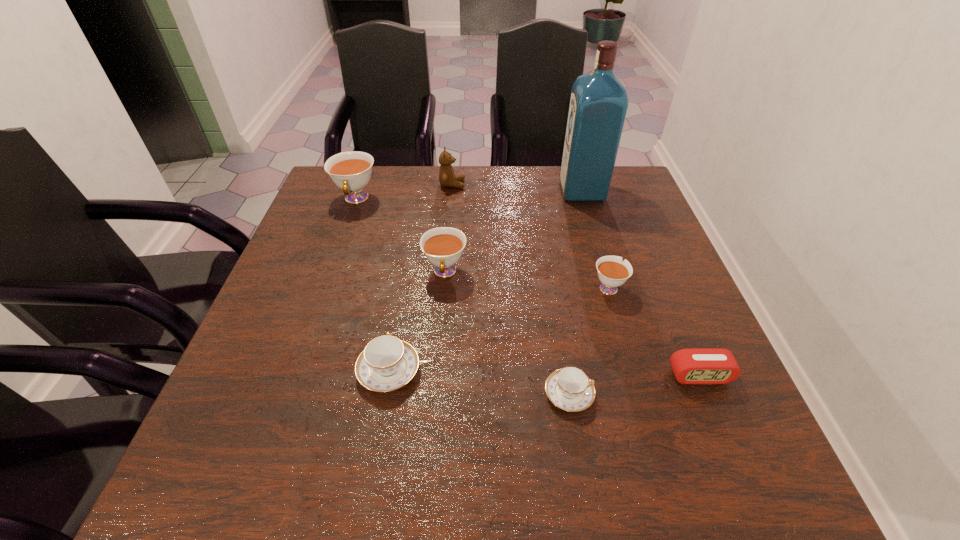
Find the location of `teacup present at the far edge`. teacup present at the far edge is located at coordinates (351, 171).

This screenshot has width=960, height=540. I want to click on object located at the left edge, so click(x=351, y=171).

Find the location of a particular element. The height and width of the screenshot is (540, 960). liquor that is at the right edge is located at coordinates (598, 104).

Image resolution: width=960 pixels, height=540 pixels. Find the location of `teacup present at the right edge`. teacup present at the right edge is located at coordinates 612,272.

Identify the location of alarm clock present at the right edge. Image resolution: width=960 pixels, height=540 pixels. (690, 366).

In order to click on object that is positioned at the far left corner in this screenshot , I will do `click(351, 171)`.

The width and height of the screenshot is (960, 540). What are the coordinates of `object that is at the far right corner` in the screenshot? It's located at (598, 104).

Where is `free space at the far edge of the desktop`? This screenshot has width=960, height=540. free space at the far edge of the desktop is located at coordinates (413, 175).

Locate an element on the screen. free region at the near edge of the desktop is located at coordinates (312, 471).

Where is `free space at the left edge of the desktop`? This screenshot has width=960, height=540. free space at the left edge of the desktop is located at coordinates (325, 355).